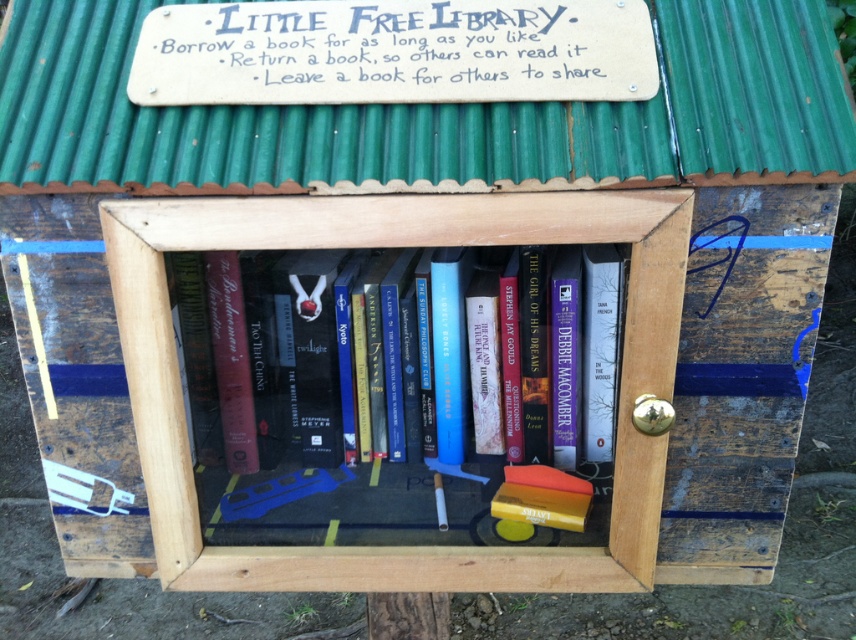
Question: Which point appears closest to the camera in this image?

Choices:
 (A) [480, 577]
 (B) [224, 387]

Answer: (A)

Question: Among these points, which one is nearest to the camera?

Choices:
 (A) (432, 417)
 (B) (357, 200)

Answer: (B)

Question: Does wooden bookshelf at center appear over hardcover book at center?

Choices:
 (A) no
 (B) yes

Answer: (A)

Question: Can you confirm if wooden bookshelf at center is bigger than hardcover book at center?

Choices:
 (A) yes
 (B) no

Answer: (A)

Question: In this image, where is wooden bookshelf at center located relative to hardcover book at center?

Choices:
 (A) above
 (B) below

Answer: (B)